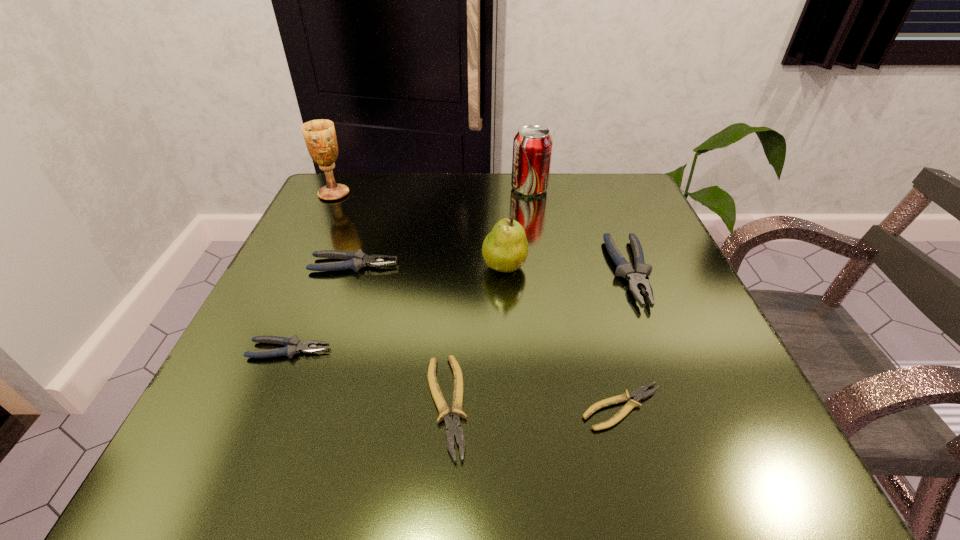
The width and height of the screenshot is (960, 540). I want to click on the third closest object relative to the fifth tallest object, so click(320, 137).

Point out which pliers is positioned as the third nearest to the second tallest object. Please provide its 2D coordinates. Your answer should be formatted as a tuple, i.e. [(x, y)], where the tuple contains the x and y coordinates of a point satisfying the conditions above.

[(453, 427)]

I want to click on pliers that is the third closest to the fourth shortest object, so click(638, 395).

You are a GUI agent. You are given a task and a screenshot of the screen. Output one action in this format:
    pyautogui.click(x=<x>, y=<y>)
    Task: Click on the second closest gray pliers to the biggest gray pliers
    The width and height of the screenshot is (960, 540).
    Given the screenshot: What is the action you would take?
    pyautogui.click(x=294, y=345)

Image resolution: width=960 pixels, height=540 pixels. I want to click on gray pliers that stands as the third closest to the pear, so pyautogui.click(x=294, y=345).

At what (x,y) coordinates should I click in order to perform the action: click on free spot that satisfies the following two spatial constraints: 1. on the front side of the shortest object; 2. on the left side of the third tallest object. Please return your answer as a coordinate pair (x, y). Image resolution: width=960 pixels, height=540 pixels. Looking at the image, I should click on (514, 408).

Locate an element on the screen. This screenshot has height=540, width=960. vacant space that satisfies the following two spatial constraints: 1. at the gripping part of the second biggest gray pliers; 2. on the back side of the third tallest object is located at coordinates (353, 267).

You are a GUI agent. You are given a task and a screenshot of the screen. Output one action in this format:
    pyautogui.click(x=<x>, y=<y>)
    Task: Click on the free point that satisfies the following two spatial constraints: 1. at the gripping part of the tallest pliers; 2. at the gripping part of the smallest gray pliers
    
    Given the screenshot: What is the action you would take?
    pyautogui.click(x=661, y=350)